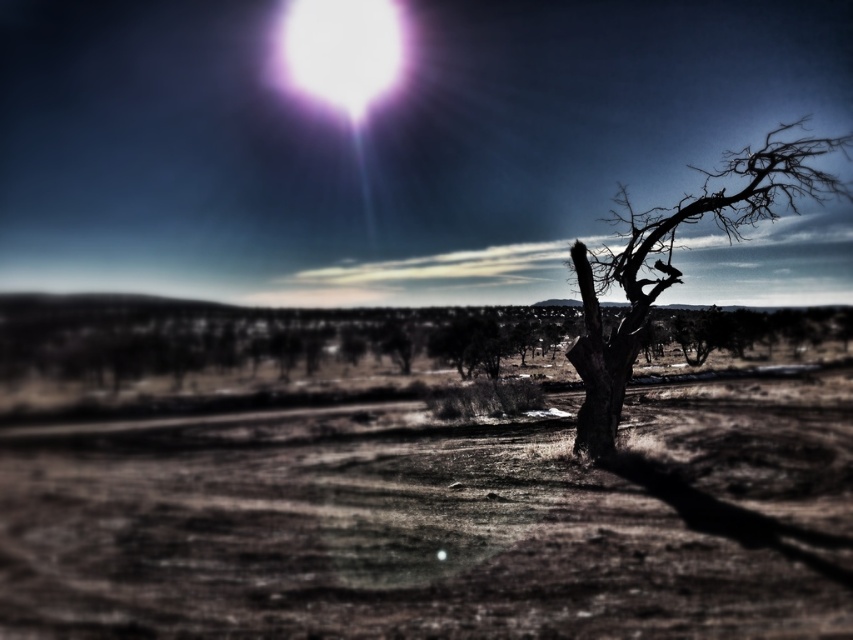
Is dark brown bark tree at right behind bright white orb at upper center?

No.

Is point (659, 250) positioned in front of point (374, 61)?

That is True.

The width and height of the screenshot is (853, 640). What are the coordinates of `dark brown bark tree at right` in the screenshot? It's located at (674, 266).

Does brown dirt field at center have a smaller size compared to dark brown bark tree at right?

Correct, brown dirt field at center occupies less space than dark brown bark tree at right.

Can you confirm if brown dirt field at center is bigger than dark brown bark tree at right?

No.

Locate an element on the screen. The image size is (853, 640). brown dirt field at center is located at coordinates (442, 522).

Does brown dirt field at center have a greater height compared to bright white orb at upper center?

No.

Can you confirm if brown dirt field at center is smaller than bright white orb at upper center?

Yes.

Locate an element on the screen. Image resolution: width=853 pixels, height=640 pixels. brown dirt field at center is located at coordinates point(442,522).